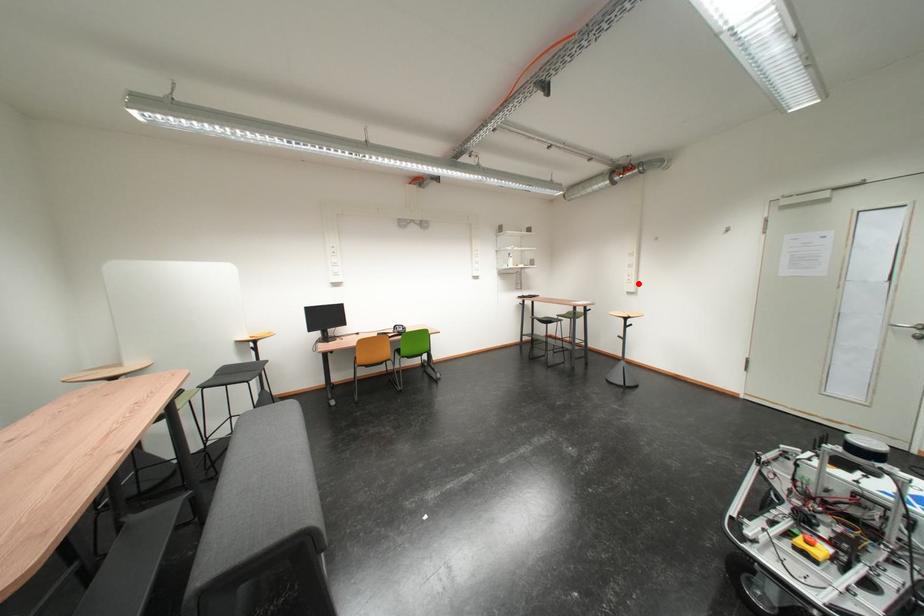
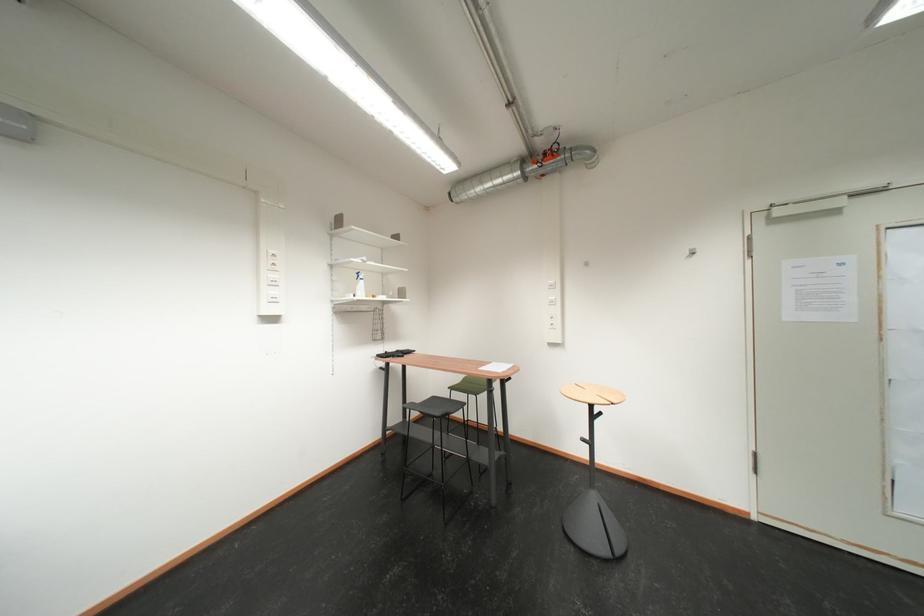
In the second image, find the point that corresponds to the highlighted location in the first image.

(562, 329)